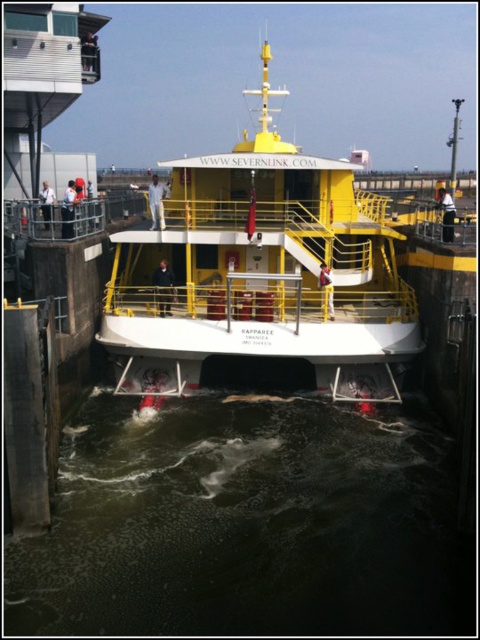
Question: Is dark murky water at lower center below yellow matte boat at center?

Choices:
 (A) no
 (B) yes

Answer: (B)

Question: Where is dark murky water at lower center located in relation to yellow matte boat at center in the image?

Choices:
 (A) left
 (B) right

Answer: (A)

Question: Can you confirm if dark murky water at lower center is positioned to the right of yellow matte boat at center?

Choices:
 (A) yes
 (B) no

Answer: (B)

Question: Which point is farther from the camera taking this photo?

Choices:
 (A) (261, 275)
 (B) (444, 445)

Answer: (A)

Question: Which point is closer to the camera?

Choices:
 (A) (231, 308)
 (B) (257, 433)

Answer: (B)

Question: Among these points, which one is farthest from the camera?

Choices:
 (A) (371, 266)
 (B) (240, 593)

Answer: (A)